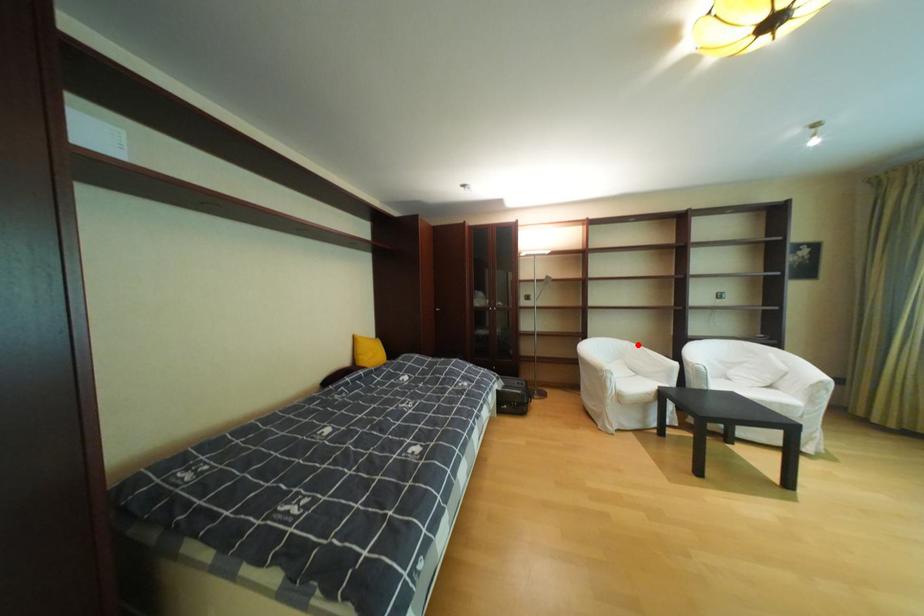
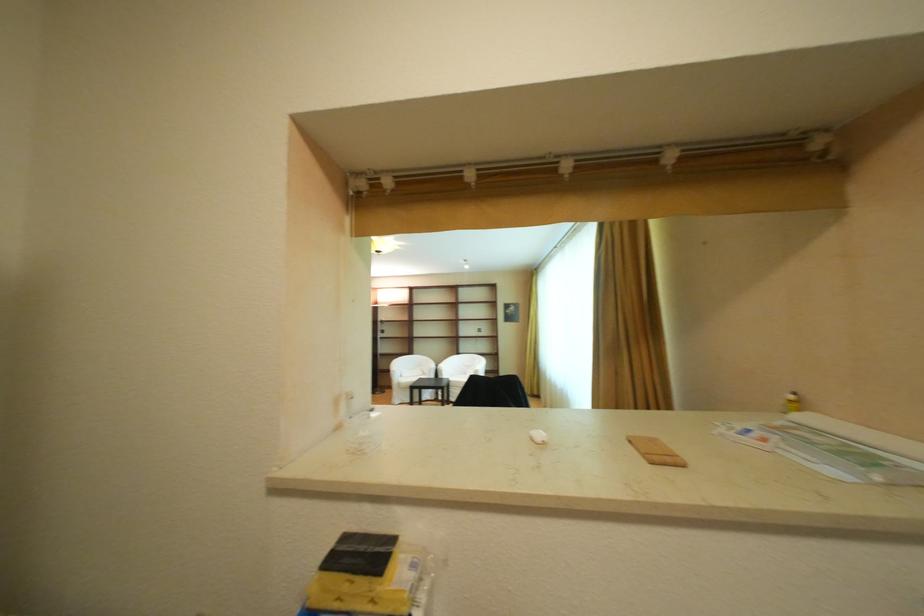
Where in the second image is the point corresponding to the highlighted location from the first image?

(436, 359)